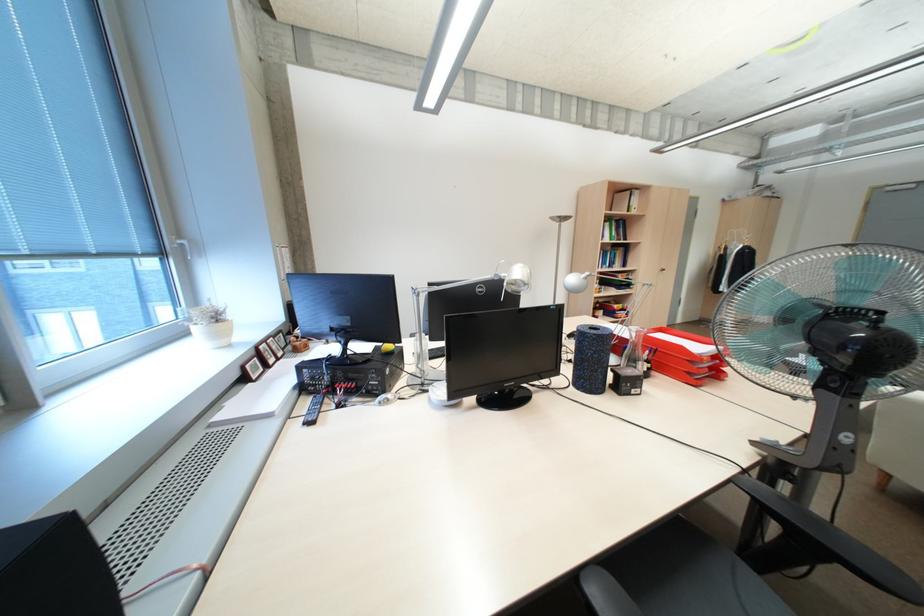
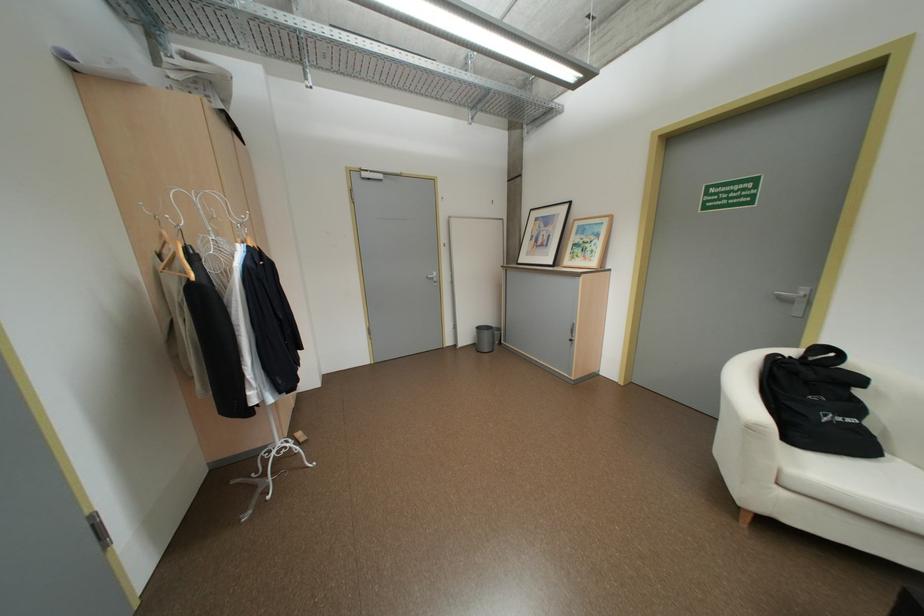
Find the pixel in the second image that matches the point at 740,246 in the first image.

(217, 252)